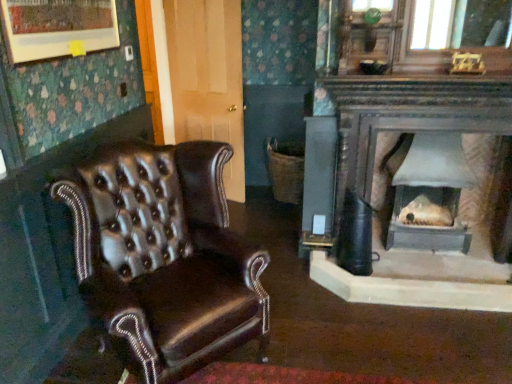
Question: Is matte gray wood burning stove at center in front of or behind shiny brown leather chair at left in the image?

Choices:
 (A) behind
 (B) front

Answer: (A)

Question: In the image, is matte gray wood burning stove at center on the left side or the right side of shiny brown leather chair at left?

Choices:
 (A) right
 (B) left

Answer: (A)

Question: From a real-world perspective, relative to shiny brown leather chair at left, is matte gray wood burning stove at center vertically above or below?

Choices:
 (A) above
 (B) below

Answer: (B)

Question: In terms of width, does shiny brown leather chair at left look wider or thinner when compared to matte gray wood burning stove at center?

Choices:
 (A) wide
 (B) thin

Answer: (A)

Question: Looking at the image, does shiny brown leather chair at left seem bigger or smaller compared to matte gray wood burning stove at center?

Choices:
 (A) big
 (B) small

Answer: (A)

Question: Relative to matte gray wood burning stove at center, is shiny brown leather chair at left in front or behind?

Choices:
 (A) front
 (B) behind

Answer: (A)

Question: From a real-world perspective, is shiny brown leather chair at left above or below matte gray wood burning stove at center?

Choices:
 (A) above
 (B) below

Answer: (A)